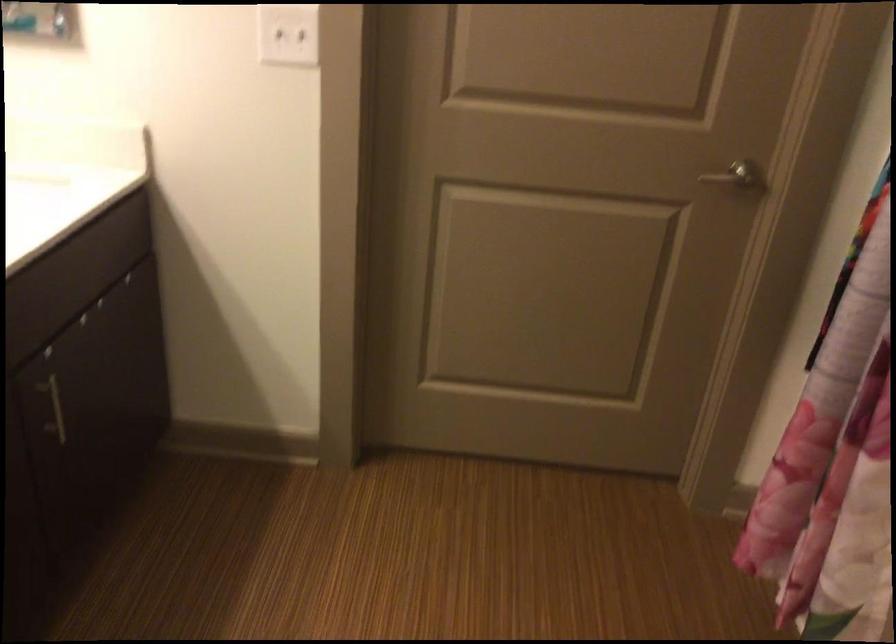
This screenshot has width=896, height=644. I want to click on silver door handle, so click(739, 178).